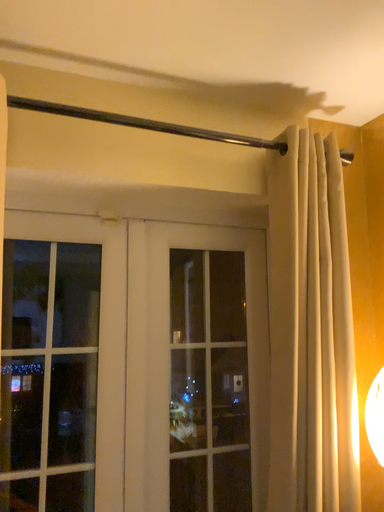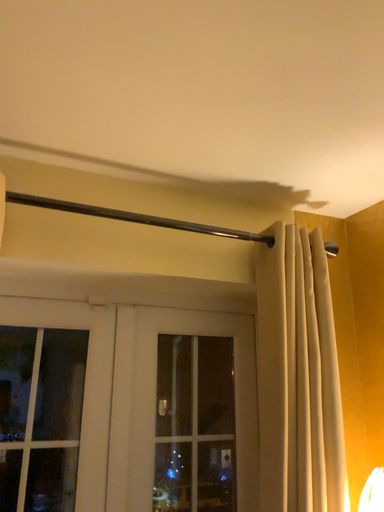
Question: Which way did the camera rotate in the video?

Choices:
 (A) rotated upward
 (B) rotated downward

Answer: (A)